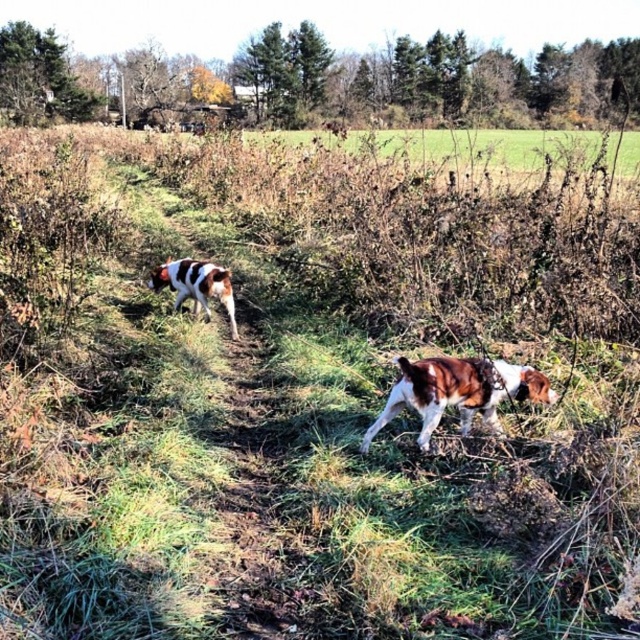
You are a hiker who has lost your way on a narrow dirt trail surrounded by overgrown vegetation. You see two dogs ahead of you on the path. One is a brown and white fur at center and the other is a brown and white speckled dog at left. Which dog is closer to you?

The brown and white fur at center is positioned under the brown and white speckled dog at left, meaning the brown and white speckled dog at left is closer to you.

You are a hiker who wants to place a GPS tracker between the brown and white fur at center and the brown and white speckled dog at left. The tracker has a range of 2 meters. Will the tracker be able to maintain a connection between the two objects?

The brown and white fur at center is 2.28 meters away from the brown and white speckled dog at left. Since the GPS tracker has a 2 meter range, the distance is too great for the tracker to maintain a connection between the two objects.